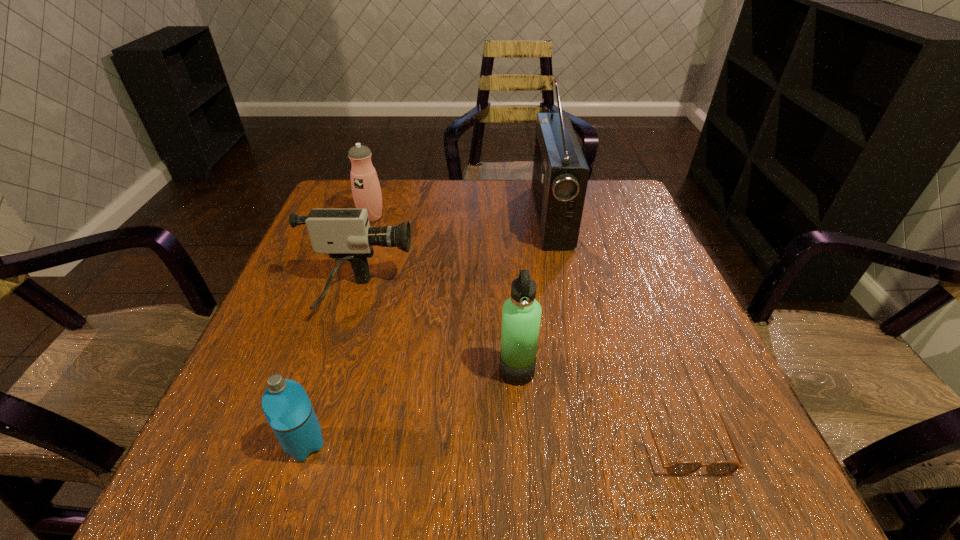
At what (x,y) coordinates should I click in order to perform the action: click on vacant area situated 0.360m on the front-facing side of the fifth object from left to right. Please return your answer as a coordinate pair (x, y). This screenshot has width=960, height=540. Looking at the image, I should click on (399, 215).

This screenshot has width=960, height=540. In order to click on vacant space located on the front-facing side of the fifth object from left to right in this screenshot , I will do `click(474, 215)`.

The height and width of the screenshot is (540, 960). I want to click on vacant space located on the left of the fourth object from left to right, so click(x=354, y=371).

Identify the location of free space located 0.380m on the front of the farthest thermos bottle. Image resolution: width=960 pixels, height=540 pixels. (331, 336).

The width and height of the screenshot is (960, 540). Identify the location of blank area located 0.110m on the recording direction of the camcorder. (464, 296).

Image resolution: width=960 pixels, height=540 pixels. What are the coordinates of `vacant area situated on the right of the shortest thermos bottle` in the screenshot? It's located at (441, 444).

Locate an element on the screen. This screenshot has height=540, width=960. radio receiver at the far edge is located at coordinates (560, 175).

The height and width of the screenshot is (540, 960). Identify the location of thermos bottle present at the far edge. (366, 190).

The height and width of the screenshot is (540, 960). In order to click on thermos bottle situated at the near edge in this screenshot , I will do pos(286,405).

You are a GUI agent. You are given a task and a screenshot of the screen. Output one action in this format:
    pyautogui.click(x=<x>, y=<y>)
    Task: Click on the sunglasses positioned at the near edge
    
    Given the screenshot: What is the action you would take?
    pyautogui.click(x=681, y=468)